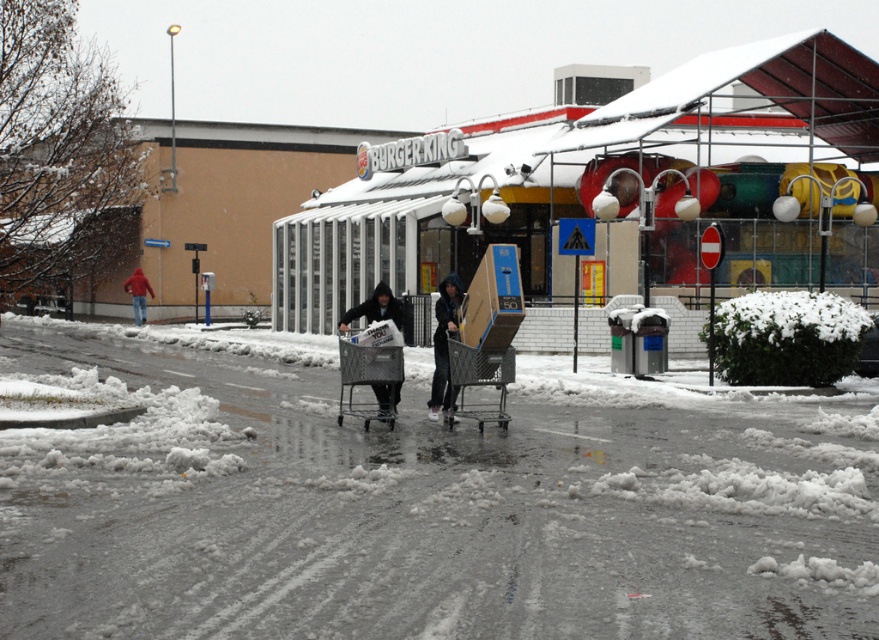
Question: Is snowy asphalt pavement at center bigger than metallic gray shopping cart at center?

Choices:
 (A) yes
 (B) no

Answer: (A)

Question: Based on their relative distances, which object is farther from the dark gray fabric cart at center?

Choices:
 (A) metallic gray shopping cart at center
 (B) snowy asphalt pavement at center

Answer: (B)

Question: Can you confirm if metallic gray shopping cart at center is positioned to the right of dark gray fabric cart at center?

Choices:
 (A) no
 (B) yes

Answer: (B)

Question: Where is snowy asphalt pavement at center located in relation to dark gray fabric cart at center in the image?

Choices:
 (A) right
 (B) left

Answer: (A)

Question: Which of the following is the farthest from the observer?

Choices:
 (A) snowy asphalt pavement at center
 (B) red jacket at left
 (C) dark gray hoodie at center
 (D) dark gray fabric cart at center

Answer: (B)

Question: Which object is closer to the camera taking this photo?

Choices:
 (A) metallic gray shopping cart at center
 (B) dark gray fabric cart at center

Answer: (A)